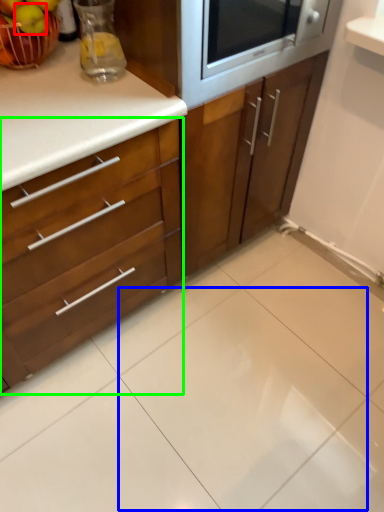
Question: Which object is positioned closest to apple (highlighted by a red box)? Select from ceramic tile (highlighted by a blue box) and cabinetry (highlighted by a green box).

Choices:
 (A) ceramic tile
 (B) cabinetry

Answer: (B)